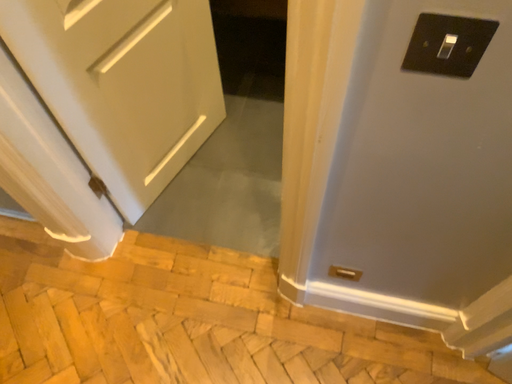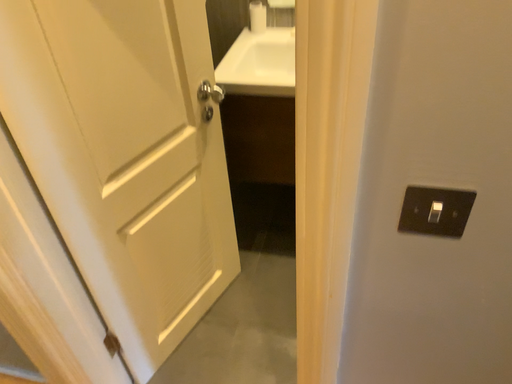
Question: How did the camera likely rotate when shooting the video?

Choices:
 (A) rotated downward
 (B) rotated upward

Answer: (B)